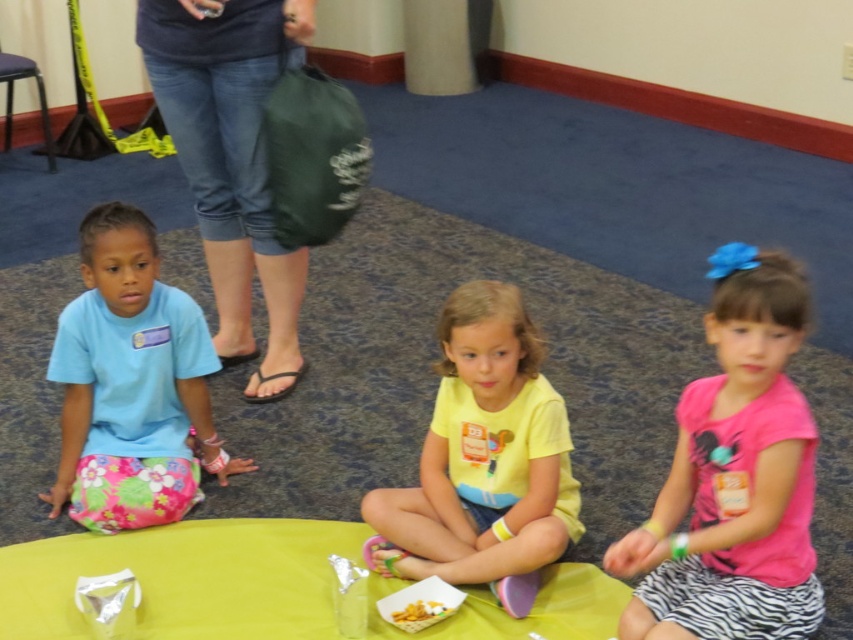
Question: Which object appears farthest from the camera in this image?

Choices:
 (A) light blue t-shirt at left
 (B) pink fabric shirt at center
 (C) yellow matte snack at center
 (D) yellow matte shirt at center

Answer: (A)

Question: Which of these objects is positioned farthest from the light blue t-shirt at left?

Choices:
 (A) yellow matte snack at center
 (B) pink fabric shirt at center

Answer: (B)

Question: Is pink fabric shirt at center below yellow matte shirt at center?

Choices:
 (A) yes
 (B) no

Answer: (B)

Question: Which of the following is the closest to the observer?

Choices:
 (A) (405, 624)
 (B) (148, 381)
 (C) (498, 477)

Answer: (A)

Question: From the image, what is the correct spatial relationship of pink fabric shirt at center in relation to yellow matte snack at center?

Choices:
 (A) below
 (B) above

Answer: (B)

Question: Is yellow matte shirt at center smaller than yellow matte snack at center?

Choices:
 (A) no
 (B) yes

Answer: (A)